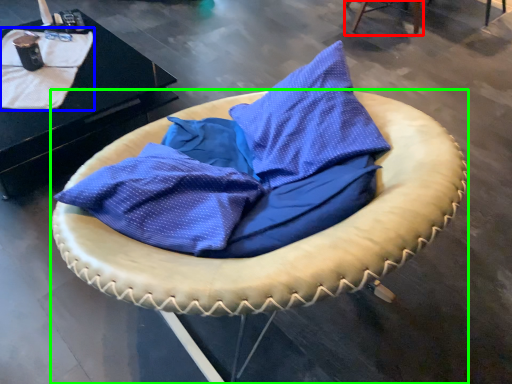
Question: Which object is the closest to the furniture (highlighted by a red box)? Choose among these: blanket (highlighted by a blue box) or furniture (highlighted by a green box).

Choices:
 (A) blanket
 (B) furniture

Answer: (A)